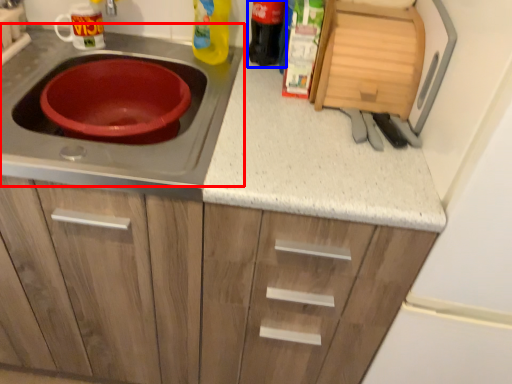
Question: Which point is further to the camera, gas stove (highlighted by a red box) or bottle (highlighted by a blue box)?

Choices:
 (A) gas stove
 (B) bottle

Answer: (B)